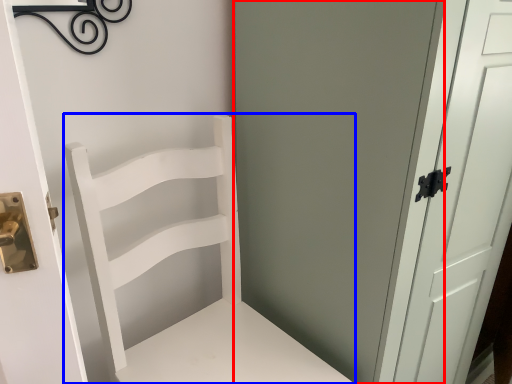
Question: Which object appears farthest to the camera in this image, screen door (highlighted by a red box) or chair (highlighted by a blue box)?

Choices:
 (A) screen door
 (B) chair

Answer: (A)